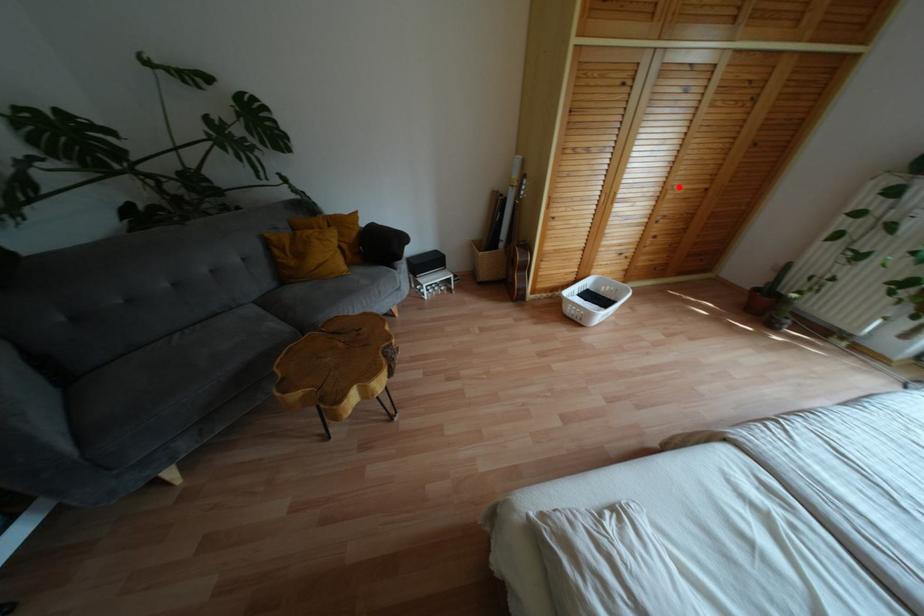
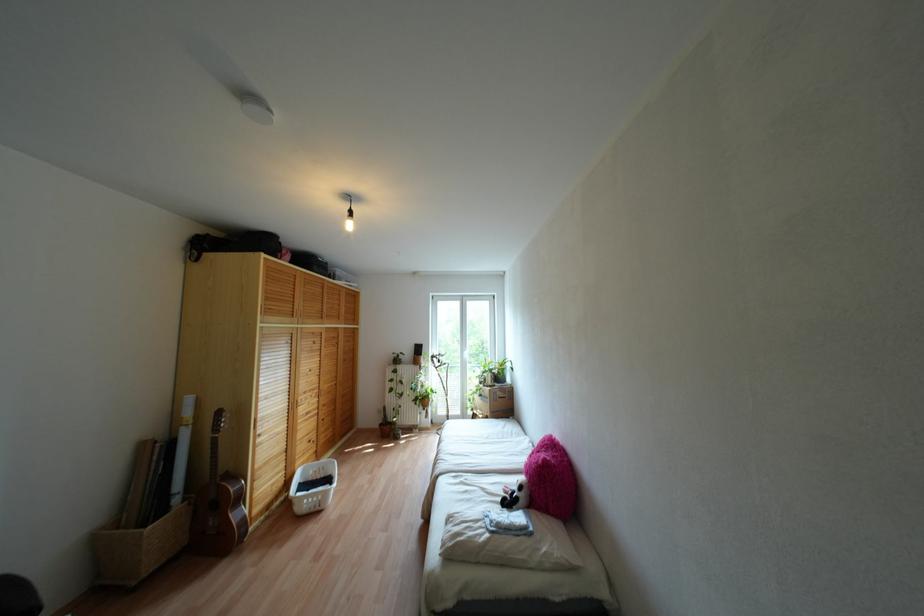
In the second image, find the point that corresponds to the highlighted location in the first image.

(324, 387)